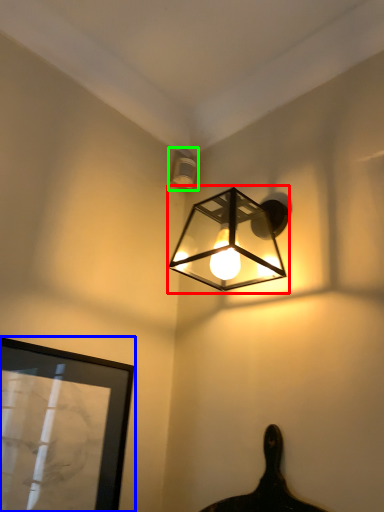
Question: Considering the real-world distances, which object is closest to lamp (highlighted by a red box)? picture frame (highlighted by a blue box) or lamp (highlighted by a green box).

Choices:
 (A) picture frame
 (B) lamp

Answer: (B)